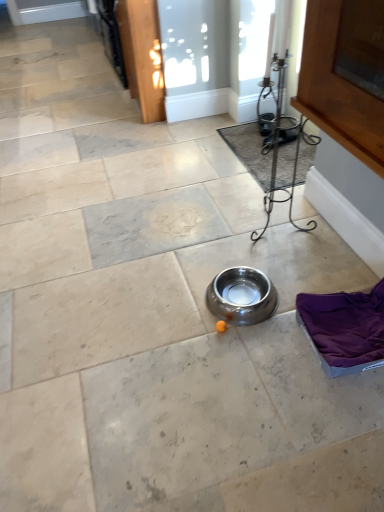
Question: Relative to carpeted mat at center, is silver metallic bowl at center in front or behind?

Choices:
 (A) behind
 (B) front

Answer: (B)

Question: Does point (251, 296) appear closer or farther from the camera than point (253, 131)?

Choices:
 (A) farther
 (B) closer

Answer: (B)

Question: From a real-world perspective, is silver metallic bowl at center positioned above or below carpeted mat at center?

Choices:
 (A) below
 (B) above

Answer: (B)

Question: In terms of height, does carpeted mat at center look taller or shorter compared to silver metallic bowl at center?

Choices:
 (A) short
 (B) tall

Answer: (A)

Question: From the image's perspective, is carpeted mat at center positioned above or below silver metallic bowl at center?

Choices:
 (A) below
 (B) above

Answer: (B)

Question: From a real-world perspective, is carpeted mat at center positioned above or below silver metallic bowl at center?

Choices:
 (A) above
 (B) below

Answer: (B)

Question: Is carpeted mat at center bigger or smaller than silver metallic bowl at center?

Choices:
 (A) small
 (B) big

Answer: (B)